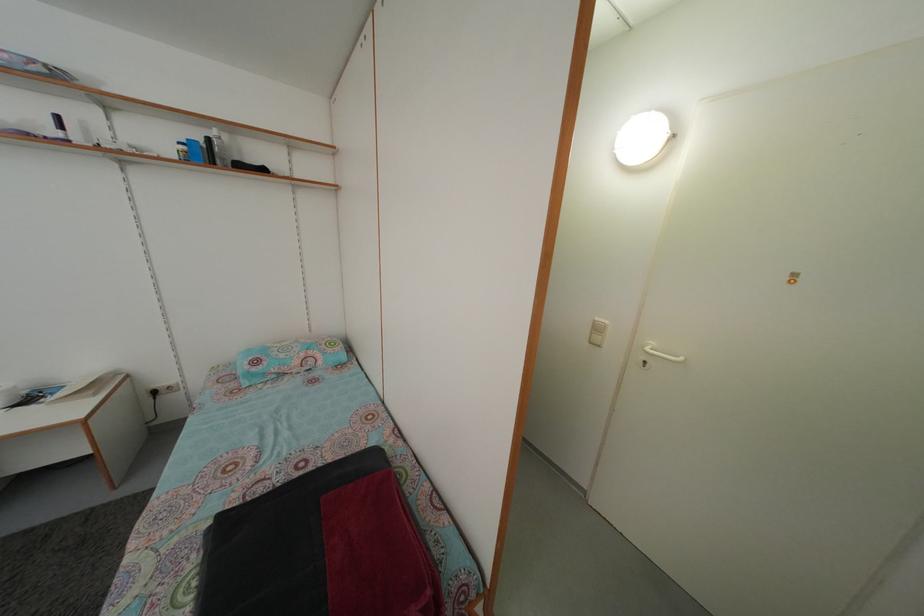
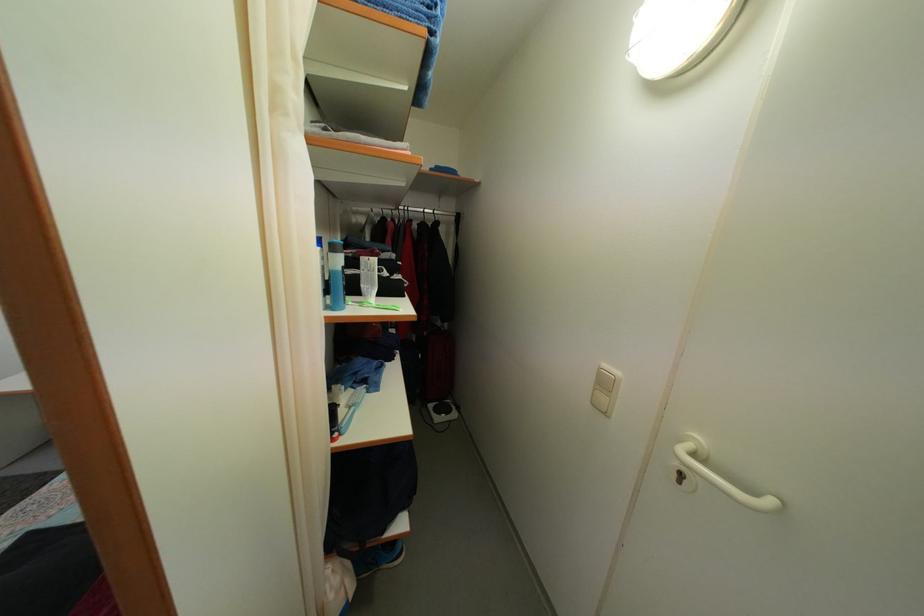
Question: The images are taken continuously from a first-person perspective. In which direction is your viewpoint rotating?

Choices:
 (A) Left
 (B) Right
 (C) Up
 (D) Down

Answer: (A)